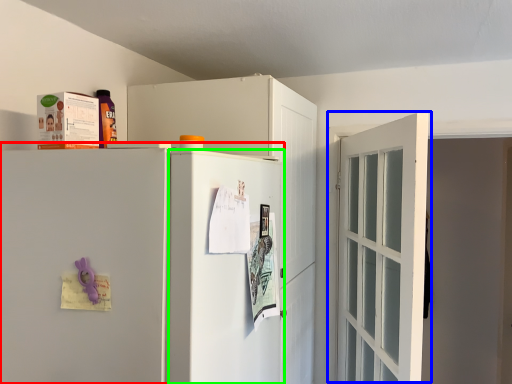
Question: Considering the real-world distances, which object is closest to refrigerator (highlighted by a red box)? door (highlighted by a blue box) or screen door (highlighted by a green box).

Choices:
 (A) door
 (B) screen door

Answer: (B)